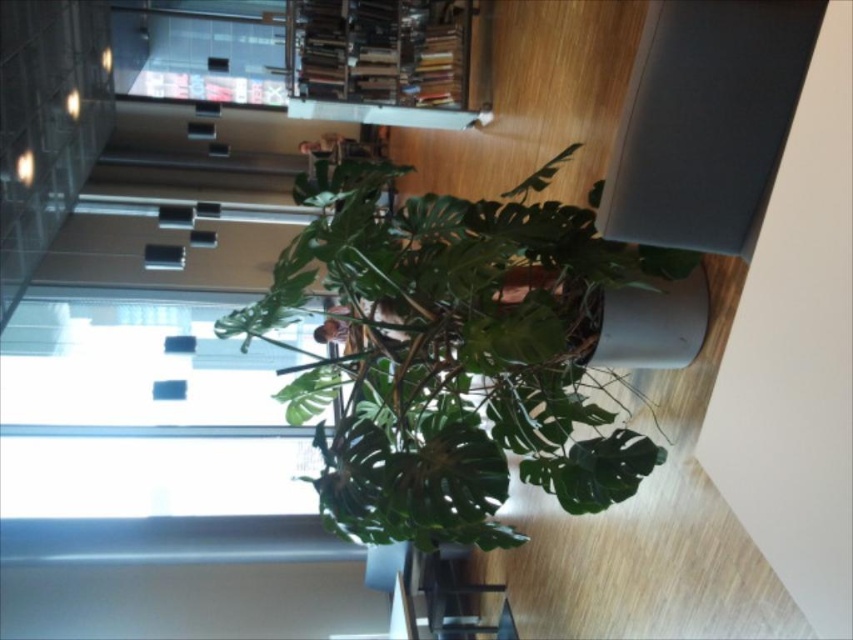
Question: Among these points, which one is nearest to the camera?

Choices:
 (A) (399, 584)
 (B) (437, 202)

Answer: (B)

Question: Is green leafy plant at center thinner than transparent glass table at lower center?

Choices:
 (A) no
 (B) yes

Answer: (A)

Question: Among these objects, which one is nearest to the camera?

Choices:
 (A) green leafy plant at center
 (B) transparent glass table at lower center

Answer: (A)

Question: Which point appears farthest from the camera in this image?

Choices:
 (A) (364, 422)
 (B) (398, 605)

Answer: (B)

Question: Can you confirm if green leafy plant at center is positioned to the right of transparent glass table at lower center?

Choices:
 (A) yes
 (B) no

Answer: (A)

Question: Where is green leafy plant at center located in relation to transparent glass table at lower center in the image?

Choices:
 (A) below
 (B) above

Answer: (B)